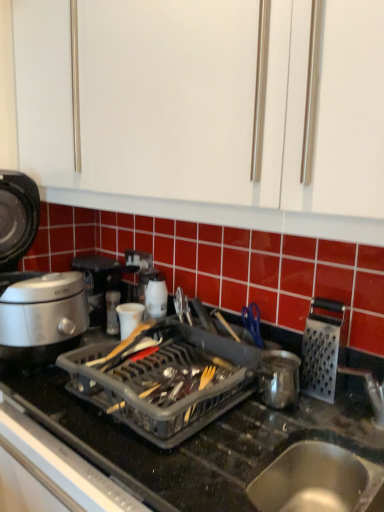
Question: Should I look upward or downward to see white plastic kettle at center, the 3th kitchen appliance positioned from the right?

Choices:
 (A) down
 (B) up

Answer: (A)

Question: Is shiny metallic pot at center, placed as the 4th kitchen appliance when sorted from left to right, facing away from metallic stainless steel sink at lower right?

Choices:
 (A) yes
 (B) no

Answer: (B)

Question: Can you confirm if shiny metallic pot at center, placed as the 4th kitchen appliance when sorted from left to right, is taller than metallic stainless steel sink at lower right?

Choices:
 (A) no
 (B) yes

Answer: (A)

Question: Is shiny metallic pot at center, placed as the 4th kitchen appliance when sorted from left to right, outside of metallic stainless steel sink at lower right?

Choices:
 (A) no
 (B) yes

Answer: (B)

Question: From a real-world perspective, is shiny metallic pot at center, the second kitchen appliance in the right-to-left sequence, on top of metallic stainless steel sink at lower right?

Choices:
 (A) no
 (B) yes

Answer: (B)

Question: Would you consider shiny metallic pot at center, placed as the 4th kitchen appliance when sorted from left to right, to be distant from metallic stainless steel sink at lower right?

Choices:
 (A) yes
 (B) no

Answer: (B)

Question: Is shiny metallic pot at center, the second kitchen appliance in the right-to-left sequence, at the right side of metallic stainless steel sink at lower right?

Choices:
 (A) no
 (B) yes

Answer: (A)

Question: Is black plastic dish rack at center far away from white matte cup at center, arranged as the second kitchen appliance when viewed from the left?

Choices:
 (A) no
 (B) yes

Answer: (A)

Question: Does black plastic dish rack at center appear on the left side of white matte cup at center, which is the 4th kitchen appliance from right to left?

Choices:
 (A) no
 (B) yes

Answer: (A)

Question: Is the depth of black plastic dish rack at center less than that of white matte cup at center, arranged as the second kitchen appliance when viewed from the left?

Choices:
 (A) no
 (B) yes

Answer: (B)

Question: From a real-world perspective, is black plastic dish rack at center physically above white matte cup at center, arranged as the second kitchen appliance when viewed from the left?

Choices:
 (A) no
 (B) yes

Answer: (A)

Question: Is the position of black plastic dish rack at center more distant than that of white matte cup at center, which is the 4th kitchen appliance from right to left?

Choices:
 (A) no
 (B) yes

Answer: (A)

Question: Is black plastic dish rack at center turned away from white matte cup at center, arranged as the second kitchen appliance when viewed from the left?

Choices:
 (A) no
 (B) yes

Answer: (A)

Question: Does silver metallic rice cooker at left, the 5th kitchen appliance when ordered from right to left, come behind shiny metallic pot at center, placed as the 4th kitchen appliance when sorted from left to right?

Choices:
 (A) no
 (B) yes

Answer: (A)